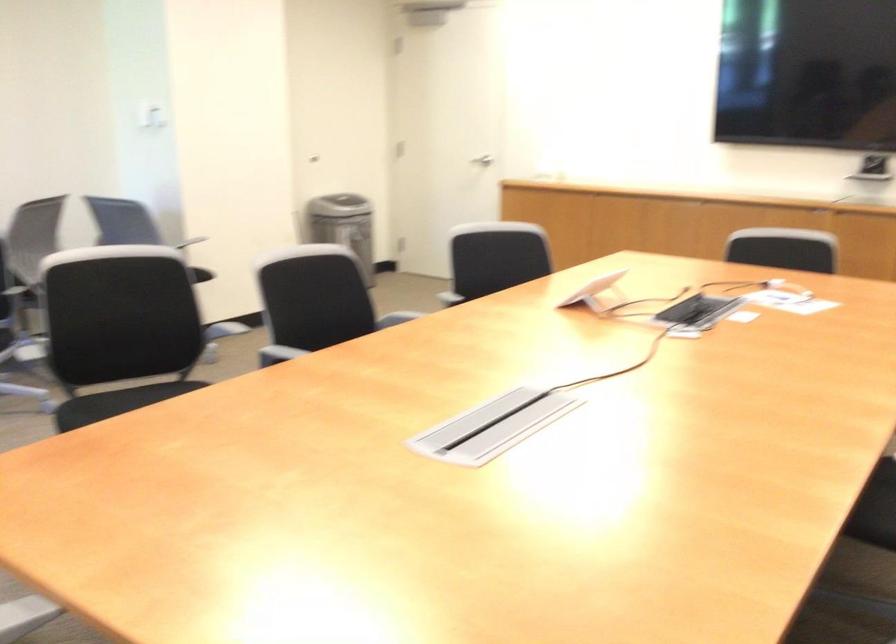
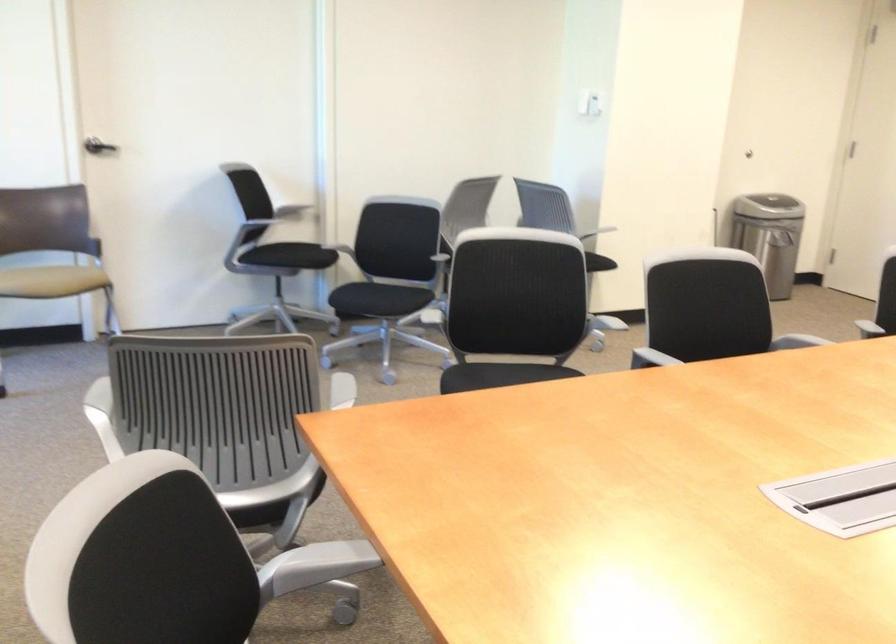
Question: The images are taken continuously from a first-person perspective. In which direction is your viewpoint rotating?

Choices:
 (A) Left
 (B) Right
 (C) Up
 (D) Down

Answer: (A)